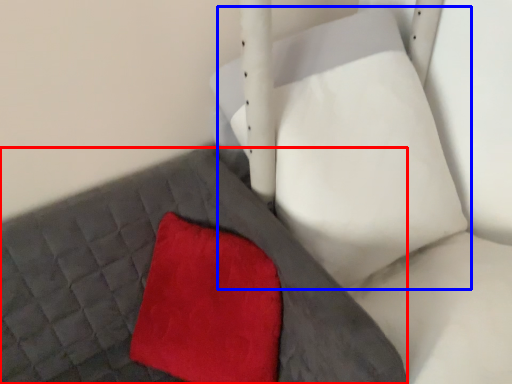
Question: Which of the following is the farthest to the observer, bed frame (highlighted by a red box) or bean bag chair (highlighted by a blue box)?

Choices:
 (A) bed frame
 (B) bean bag chair

Answer: (A)